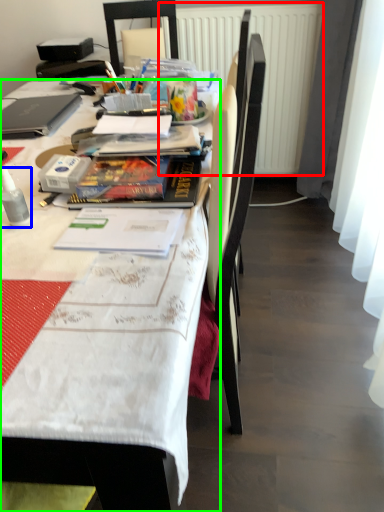
Question: Which is farther away from radiator (highlighted by a red box)? bottle (highlighted by a blue box) or desk (highlighted by a green box)?

Choices:
 (A) bottle
 (B) desk

Answer: (A)